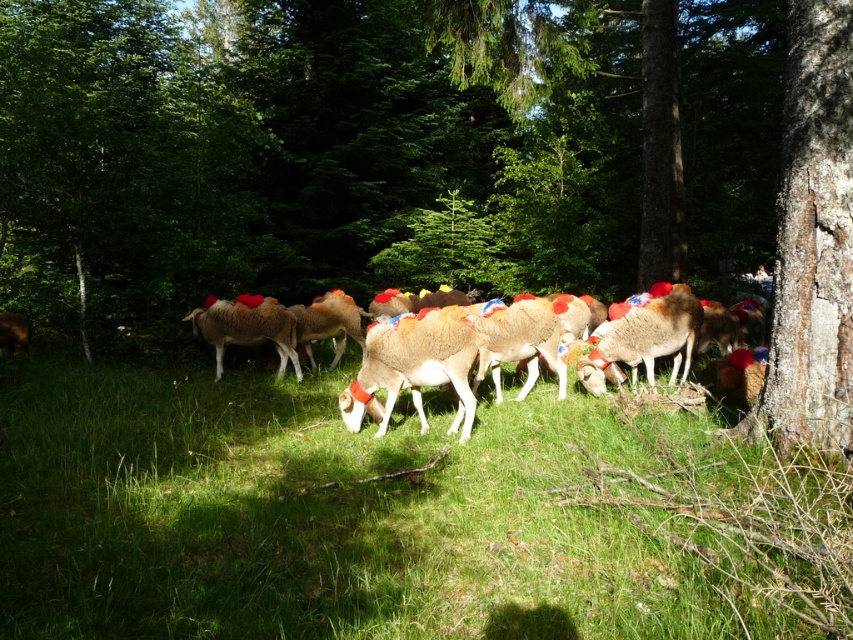
Question: Where is brown rough tree at center-right located in relation to light brown woolen goat at center in the image?

Choices:
 (A) left
 (B) right

Answer: (A)

Question: Does green grassy at center appear on the right side of light brown woolen goat at center?

Choices:
 (A) yes
 (B) no

Answer: (A)

Question: Can you confirm if green grassy at center is positioned to the right of light brown woolen goat at center?

Choices:
 (A) no
 (B) yes

Answer: (B)

Question: Which of the following is the farthest from the observer?

Choices:
 (A) (805, 148)
 (B) (260, 307)

Answer: (B)

Question: Which point is farther to the camera?

Choices:
 (A) (630, 332)
 (B) (537, 584)
 (C) (186, 12)
 (D) (457, 410)

Answer: (C)

Question: Based on their relative distances, which object is nearer to the light brown woolen sheep at center?

Choices:
 (A) brown rough tree at center-right
 (B) green grassy at center
 (C) light brown woolen goat at center

Answer: (C)